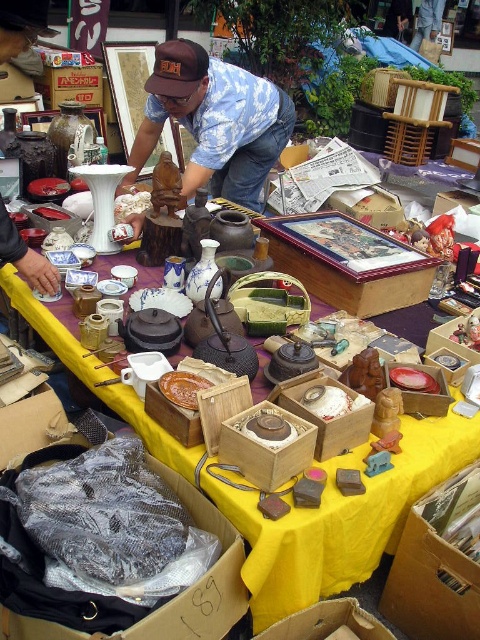
Question: Among these objects, which one is nearest to the camera?

Choices:
 (A) brown leather cap at upper center
 (B) brown wooden plate at center
 (C) white matte rice at center

Answer: (B)

Question: Is wooden box with painted picture at center above white matte rice at center?

Choices:
 (A) no
 (B) yes

Answer: (B)

Question: Which is farther from the brown wooden plate at center?

Choices:
 (A) white matte rice at center
 (B) cardboard box at lower center

Answer: (B)

Question: Which object is positioned closest to the brown fabric cap at upper center?

Choices:
 (A) cardboard box at lower center
 (B) plastic wrapped cloth at lower left
 (C) white matte rice at center

Answer: (C)

Question: Considering the relative positions of plastic wrapped cloth at lower left and white matte rice at center in the image provided, where is plastic wrapped cloth at lower left located with respect to white matte rice at center?

Choices:
 (A) right
 (B) left

Answer: (B)

Question: Observing the image, what is the correct spatial positioning of plastic wrapped cloth at lower left in reference to cardboard box at lower center?

Choices:
 (A) left
 (B) right

Answer: (A)